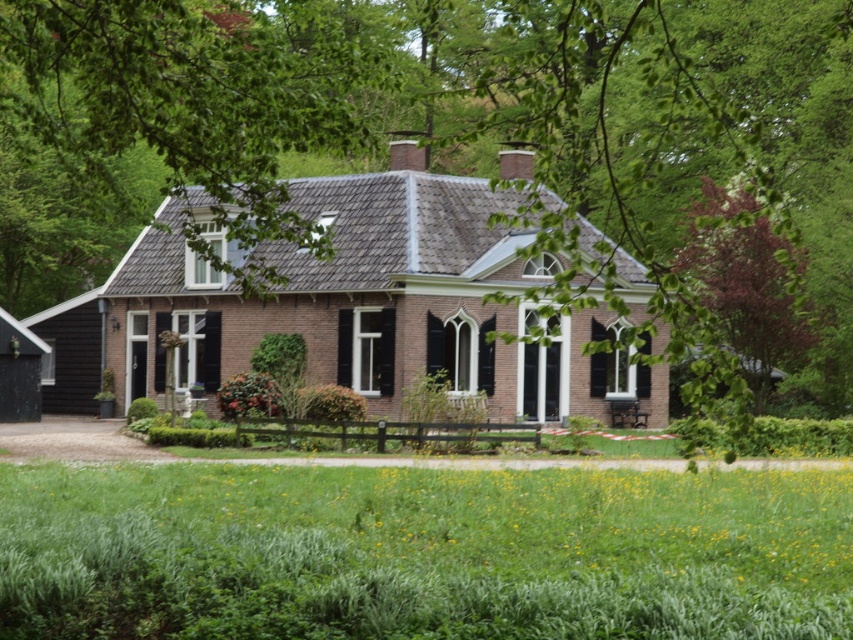
Can you confirm if green leafy tree at upper center is positioned above brown brick cottage at center?

Yes, green leafy tree at upper center is above brown brick cottage at center.

Does point (527, 19) come closer to viewer compared to point (395, 276)?

That is False.

What are the coordinates of `green leafy tree at upper center` in the screenshot? It's located at (467, 144).